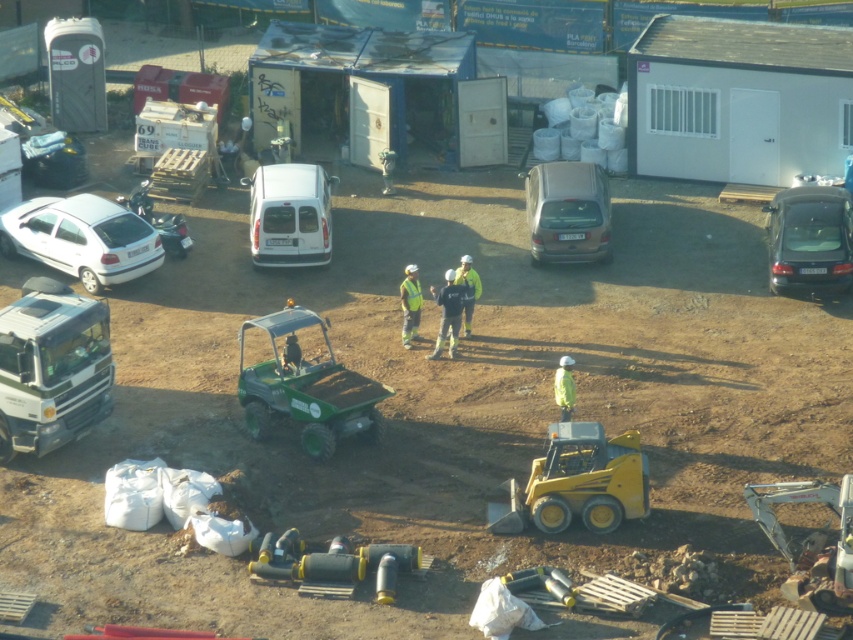
Question: Which object is farther from the camera taking this photo?

Choices:
 (A) shiny black sedan at right
 (B) reflective yellow safety vest at center
 (C) high visibility fabric safety vest at center
 (D) metallic silver van at left

Answer: (D)

Question: Among these objects, which one is farthest from the camera?

Choices:
 (A) reflective yellow safety vest at center
 (B) white matte hatchback at left
 (C) white matte van at center
 (D) high visibility fabric safety vest at center

Answer: (C)

Question: Is white matte hatchback at left bigger than reflective yellow safety vest at center?

Choices:
 (A) no
 (B) yes

Answer: (B)

Question: Which point is farther to the camera?

Choices:
 (A) white matte truck at left
 (B) white matte hatchback at left

Answer: (B)

Question: Observing the image, what is the correct spatial positioning of white matte van at center in reference to metallic silver van at left?

Choices:
 (A) left
 (B) right

Answer: (B)

Question: In this image, where is white matte hatchback at left located relative to satin gold car at center?

Choices:
 (A) below
 (B) above

Answer: (A)